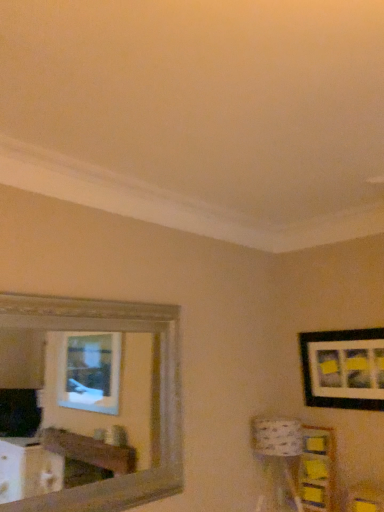
Question: Can you see yellow paper at lower right touching black matte picture frame at upper right?

Choices:
 (A) no
 (B) yes

Answer: (A)

Question: From a real-world perspective, is yellow paper at lower right on black matte picture frame at upper right?

Choices:
 (A) yes
 (B) no

Answer: (B)

Question: Does yellow paper at lower right have a greater height compared to black matte picture frame at upper right?

Choices:
 (A) no
 (B) yes

Answer: (B)

Question: Is yellow paper at lower right positioned with its back to black matte picture frame at upper right?

Choices:
 (A) no
 (B) yes

Answer: (A)

Question: Does yellow paper at lower right have a smaller size compared to black matte picture frame at upper right?

Choices:
 (A) yes
 (B) no

Answer: (B)

Question: Is yellow paper at lower right far away from black matte picture frame at upper right?

Choices:
 (A) no
 (B) yes

Answer: (A)

Question: Is the position of black matte picture frame at upper right more distant than that of patterned fabric lampshade at lower right?

Choices:
 (A) no
 (B) yes

Answer: (B)

Question: Can you confirm if black matte picture frame at upper right is smaller than patterned fabric lampshade at lower right?

Choices:
 (A) no
 (B) yes

Answer: (B)

Question: Is black matte picture frame at upper right turned away from patterned fabric lampshade at lower right?

Choices:
 (A) yes
 (B) no

Answer: (B)

Question: Is black matte picture frame at upper right next to patterned fabric lampshade at lower right and touching it?

Choices:
 (A) no
 (B) yes

Answer: (A)

Question: Could patterned fabric lampshade at lower right be considered to be inside black matte picture frame at upper right?

Choices:
 (A) yes
 (B) no

Answer: (B)

Question: Considering the relative sizes of black matte picture frame at upper right and patterned fabric lampshade at lower right in the image provided, is black matte picture frame at upper right bigger than patterned fabric lampshade at lower right?

Choices:
 (A) yes
 (B) no

Answer: (B)

Question: Could black matte picture frame at upper right be considered to be inside wooden frame mirror at upper left?

Choices:
 (A) yes
 (B) no

Answer: (B)